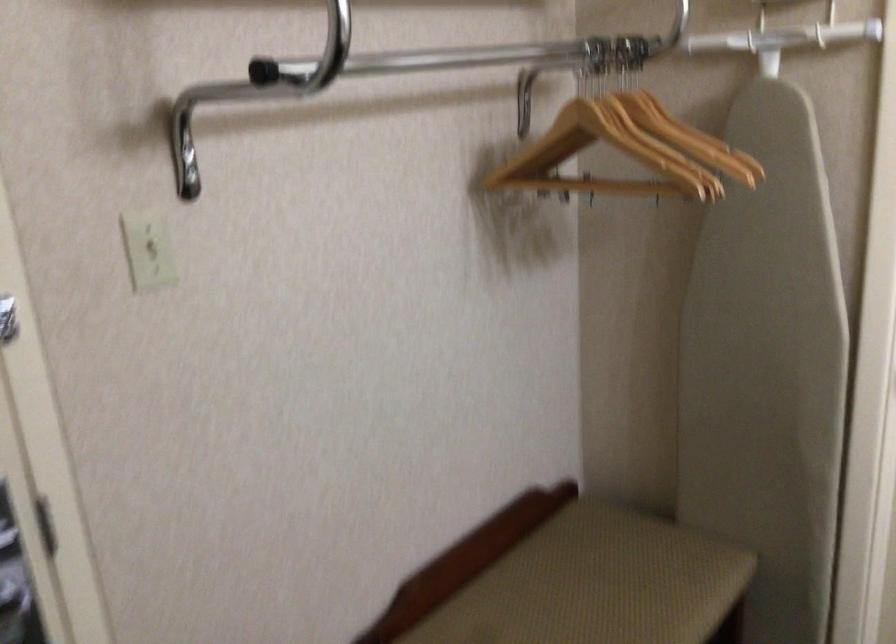
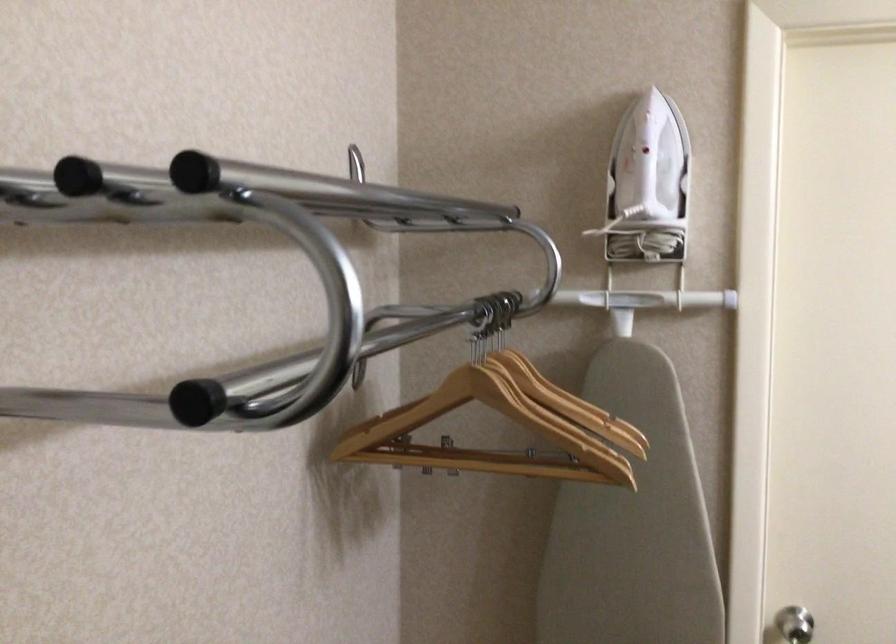
Where in the second image is the point corresponding to (662,118) from the first image?

(538, 377)